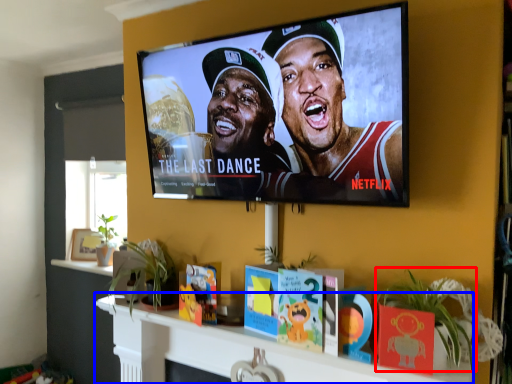
Question: Among these objects, which one is nearest to the camera, plant (highlighted by a red box) or shelf (highlighted by a blue box)?

Choices:
 (A) plant
 (B) shelf

Answer: (A)